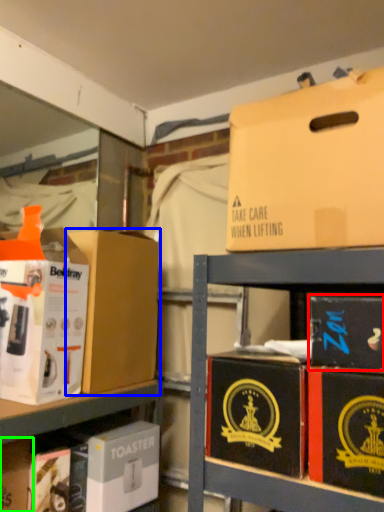
Question: Which is farther away from box (highlighted by a red box)? box (highlighted by a blue box) or storage box (highlighted by a green box)?

Choices:
 (A) box
 (B) storage box

Answer: (B)